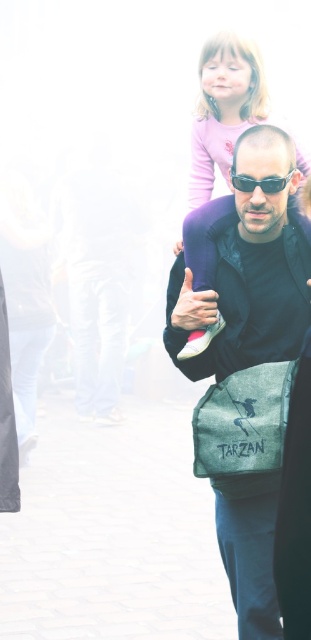
Does matte black jacket at center have a lesser height compared to sunglasses at center?

No.

Does point (245, 323) come closer to viewer compared to point (273, 188)?

No, (245, 323) is behind (273, 188).

In order to click on matte black jacket at center in this screenshot , I will do `click(246, 291)`.

Consider the image. Measure the distance between textured gray bag at center and sunglasses at center.

textured gray bag at center is 3.90 feet from sunglasses at center.

Between textured gray bag at center and sunglasses at center, which one appears on the right side from the viewer's perspective?

From the viewer's perspective, sunglasses at center appears more on the right side.

This screenshot has height=640, width=311. Identify the location of textured gray bag at center. (242, 426).

This screenshot has height=640, width=311. In order to click on textured gray bag at center in this screenshot , I will do `click(242, 426)`.

Does point (261, 262) lie in front of point (202, 417)?

No.

Locate an element on the screen. The width and height of the screenshot is (311, 640). matte black jacket at center is located at coordinates (246, 291).